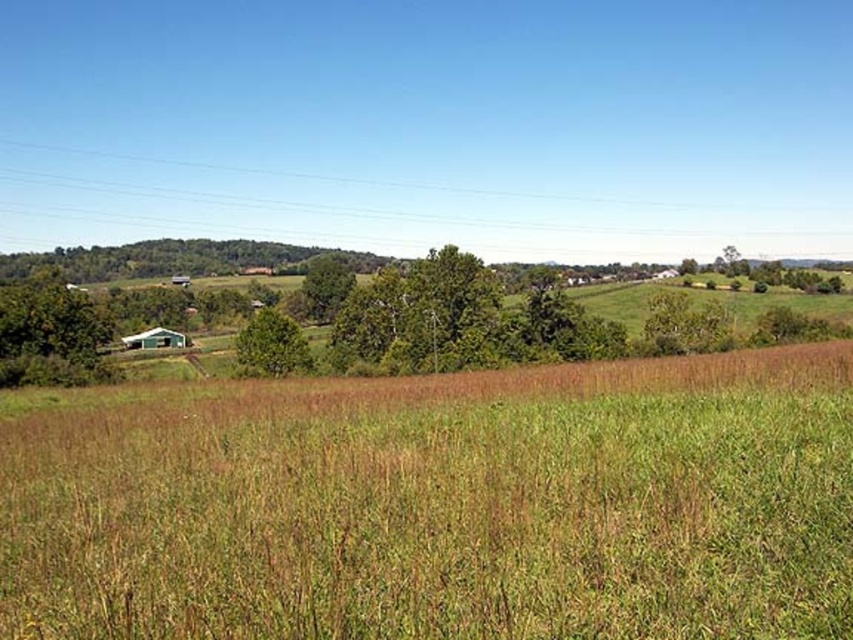
In the scene shown: Does brown wooden power line at upper center have a lesser height compared to green leafy tree at center?

In fact, brown wooden power line at upper center may be taller than green leafy tree at center.

Is point (693, 232) positioned before point (285, 360)?

No, (693, 232) is further to viewer.

Is point (492, 220) closer to viewer compared to point (257, 349)?

No, it is behind (257, 349).

In order to click on brown wooden power line at upper center in this screenshot , I will do click(325, 205).

What do you see at coordinates (50, 336) in the screenshot? I see `green matte tree at left` at bounding box center [50, 336].

Which is above, green matte tree at left or green leafy tree at center?

Positioned higher is green matte tree at left.

Where is `green matte tree at left`? This screenshot has height=640, width=853. green matte tree at left is located at coordinates (50, 336).

Between brown wooden power line at upper center and green matte tree at left, which one has more height?

Standing taller between the two is brown wooden power line at upper center.

Looking at this image, does brown wooden power line at upper center have a lesser height compared to green matte tree at left?

In fact, brown wooden power line at upper center may be taller than green matte tree at left.

Is point (136, 188) positioned behind point (32, 378)?

Yes, it is behind point (32, 378).

At what (x,y) coordinates should I click in order to perform the action: click on brown wooden power line at upper center. Please return your answer as a coordinate pair (x, y). Image resolution: width=853 pixels, height=640 pixels. Looking at the image, I should click on (325, 205).